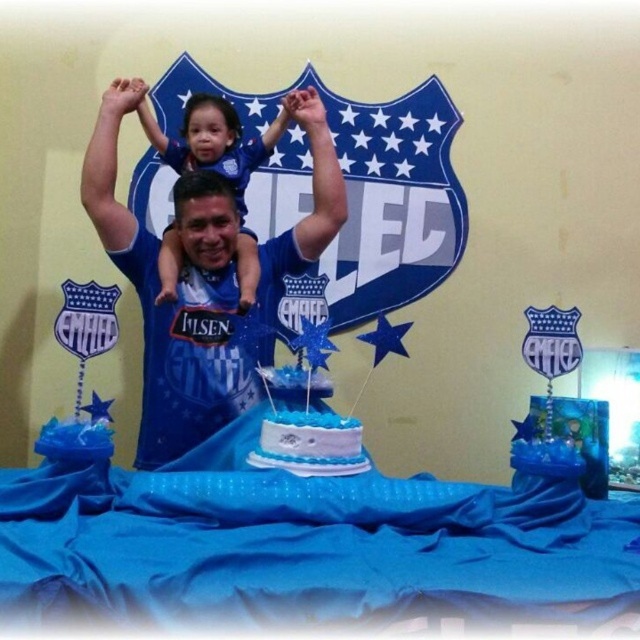
Question: Is the position of blue jersey at center less distant than that of matte blue shirt at center?

Choices:
 (A) yes
 (B) no

Answer: (B)

Question: Does blue jersey at center appear over white frosted cake at center?

Choices:
 (A) yes
 (B) no

Answer: (A)

Question: Which object is positioned farthest from the white frosted cake at center?

Choices:
 (A) blue jersey at center
 (B) matte blue shirt at center

Answer: (B)

Question: Does matte blue shirt at center lie behind white frosted cake at center?

Choices:
 (A) yes
 (B) no

Answer: (A)

Question: Which object is positioned closest to the matte blue shirt at center?

Choices:
 (A) blue jersey at center
 (B) white frosted cake at center

Answer: (A)

Question: Among these points, which one is nearest to the camera?

Choices:
 (A) (241, 252)
 (B) (189, 435)
 (C) (312, 458)

Answer: (C)